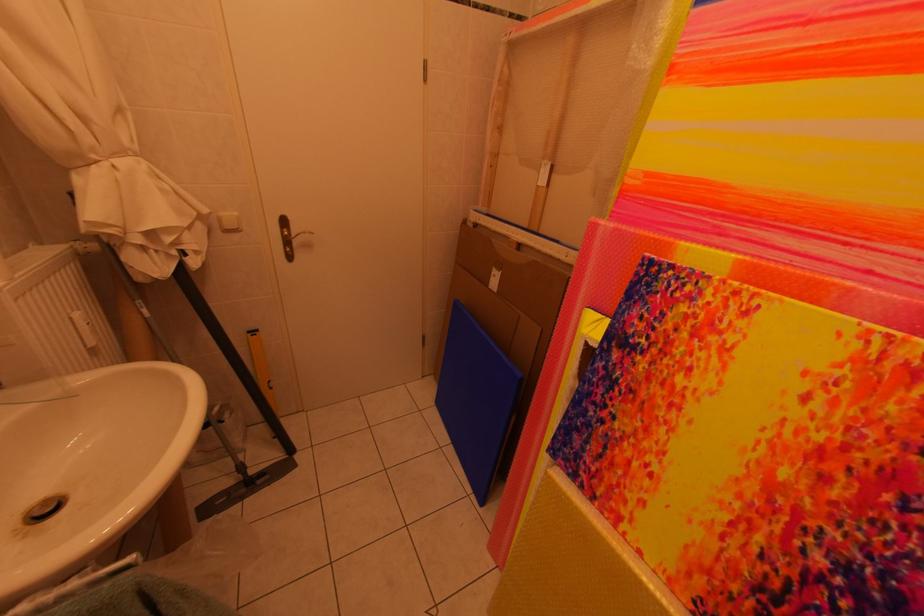
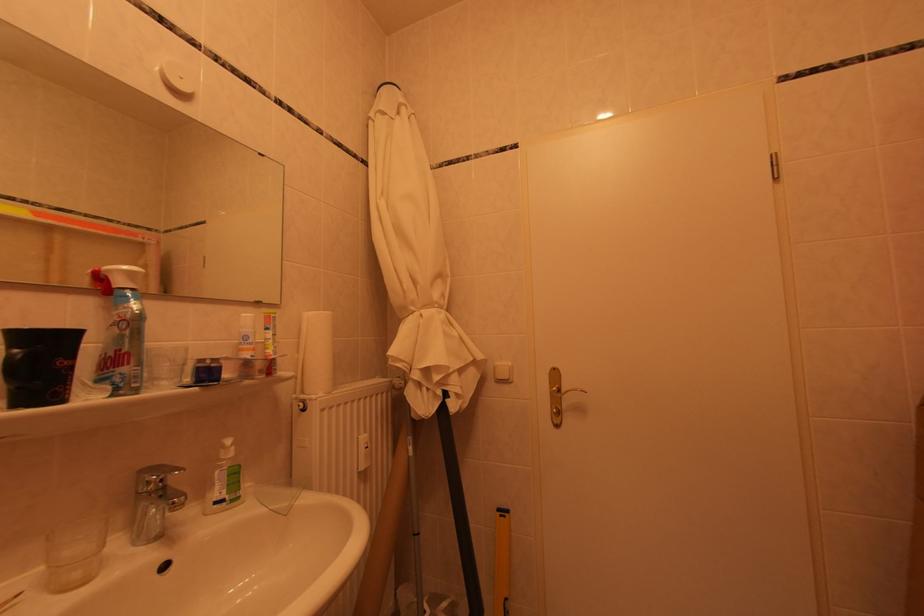
The point at (193, 262) is marked in the first image. Where is the corresponding point in the second image?

(456, 405)